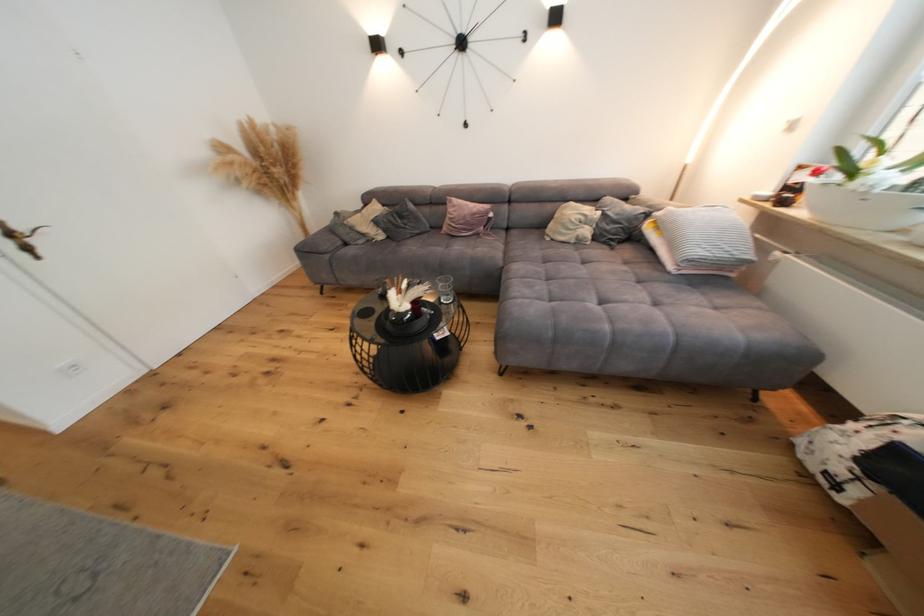
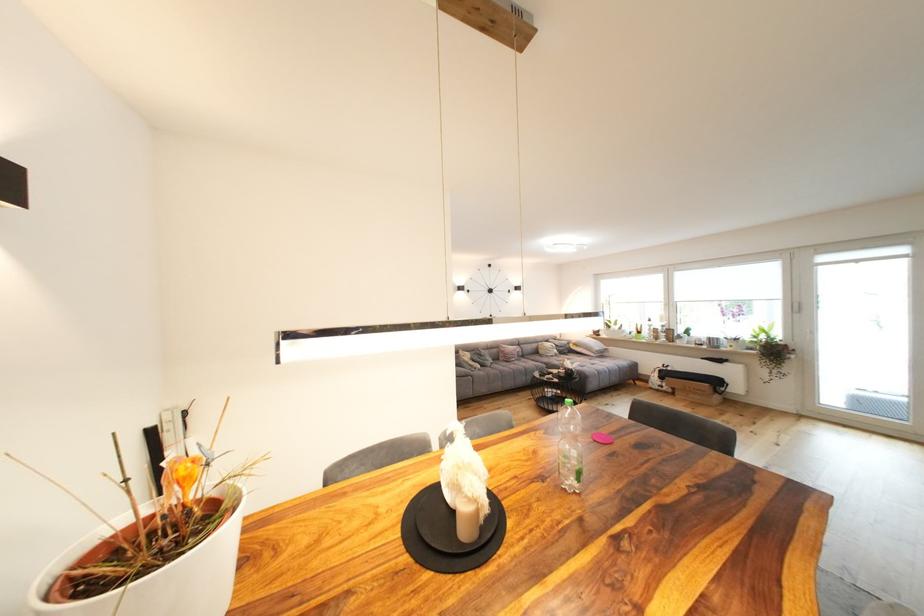
In the second image, find the point that corresponds to point (706, 254) in the first image.

(603, 350)